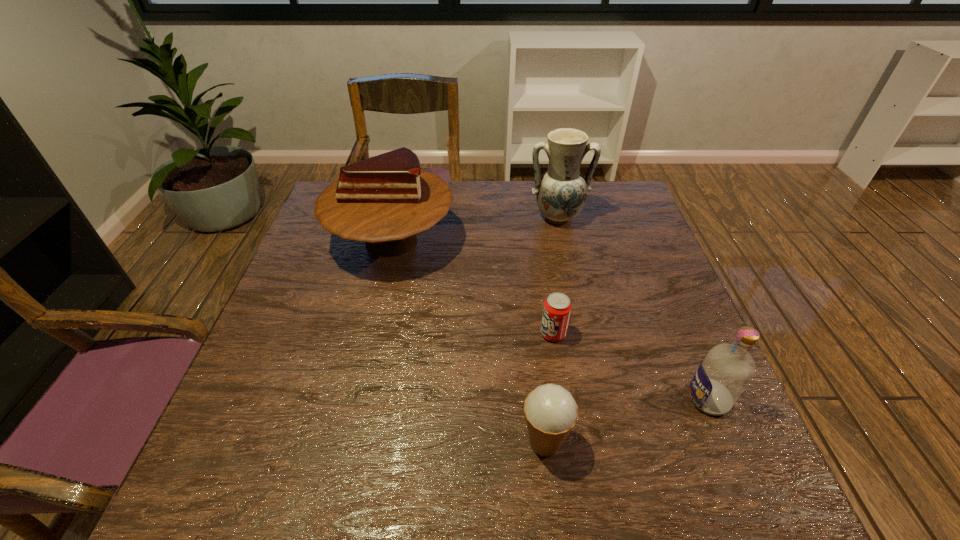
At what (x,y) coordinates should I click in order to perform the action: click on unoccupied area between the pottery and the shortest object. Please return your answer as a coordinate pair (x, y). Looking at the image, I should click on (555, 275).

You are a GUI agent. You are given a task and a screenshot of the screen. Output one action in this format:
    pyautogui.click(x=<x>, y=<y>)
    Task: Click on the vacant area that lies between the nearest object and the vodka
    
    Given the screenshot: What is the action you would take?
    pyautogui.click(x=626, y=421)

Where is `unoccupied area between the leftmost object and the shortest object`? This screenshot has height=540, width=960. unoccupied area between the leftmost object and the shortest object is located at coordinates (472, 287).

Find the location of a particular element. This screenshot has width=960, height=540. the fourth closest object relative to the cake is located at coordinates (727, 369).

This screenshot has height=540, width=960. Identify the location of the third closest object to the shortest object. pyautogui.click(x=386, y=200).

Find the location of a particular element. free spot that satisfies the following two spatial constraints: 1. on the front side of the leftmost object; 2. on the right side of the nearest object is located at coordinates (344, 442).